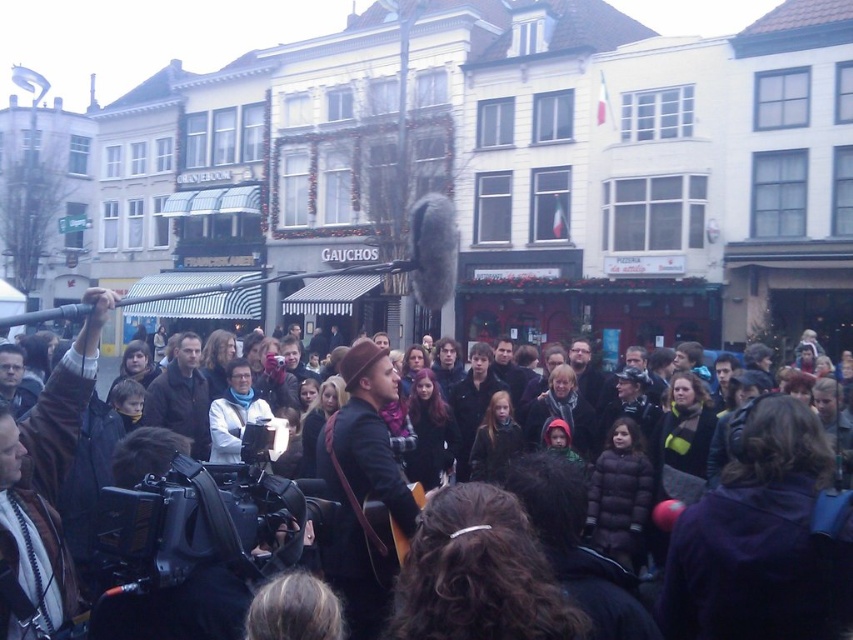
Is black plastic video camera at center positioned behind dark brown leather jacket at center?

Yes, black plastic video camera at center is behind dark brown leather jacket at center.

Does black plastic video camera at center have a lesser height compared to dark brown leather jacket at center?

Correct, black plastic video camera at center is not as tall as dark brown leather jacket at center.

Between point (231, 577) and point (374, 368), which one is positioned in front?

Point (231, 577) is more forward.

Identify the location of black plastic video camera at center. This screenshot has height=640, width=853. (196, 524).